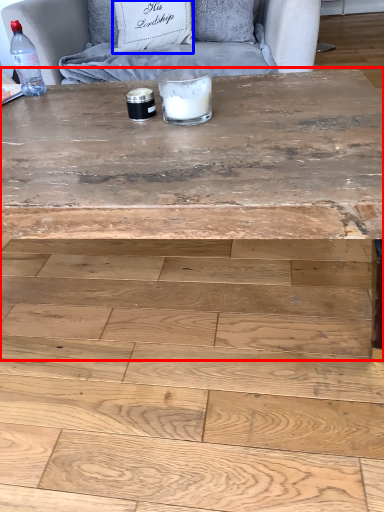
Question: Which point is closer to the camera, coffee table (highlighted by a red box) or pillow (highlighted by a blue box)?

Choices:
 (A) coffee table
 (B) pillow

Answer: (A)